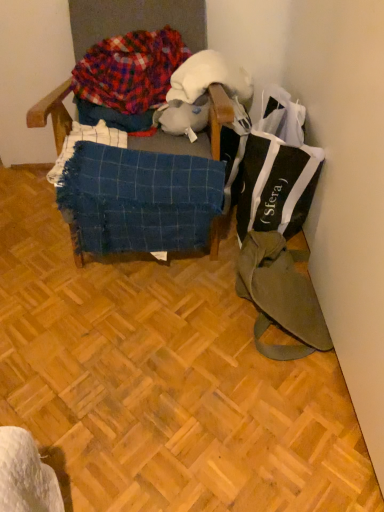
The width and height of the screenshot is (384, 512). Identify the location of vacant area that is in front of wooden chair at center. (121, 335).